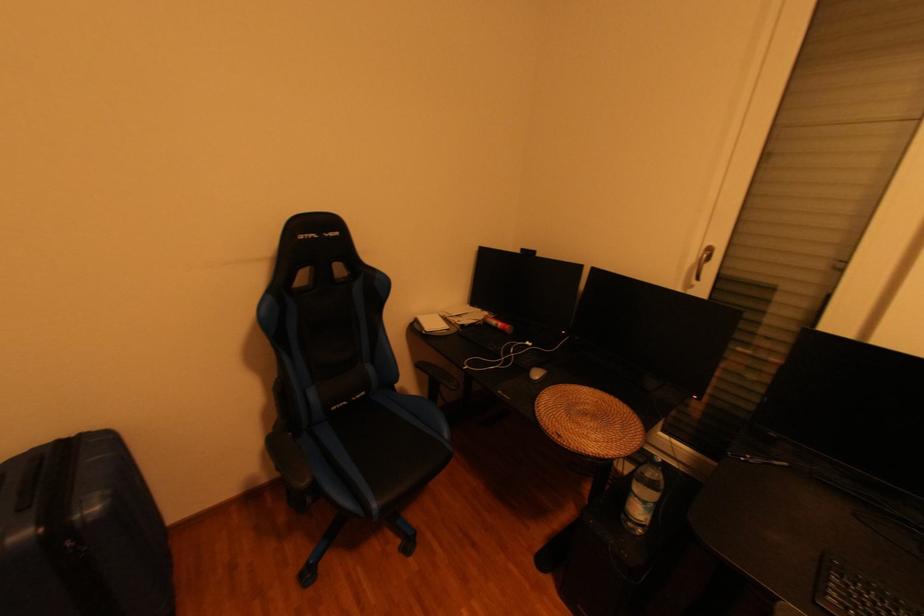
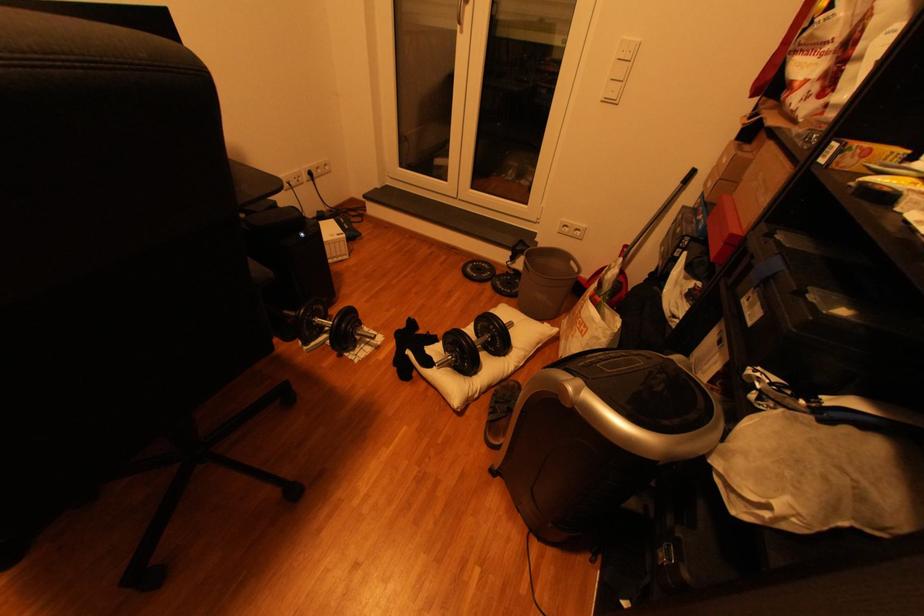
First-person continuous shooting, in which direction is the camera rotating?

The rotation direction of the camera is right-down.